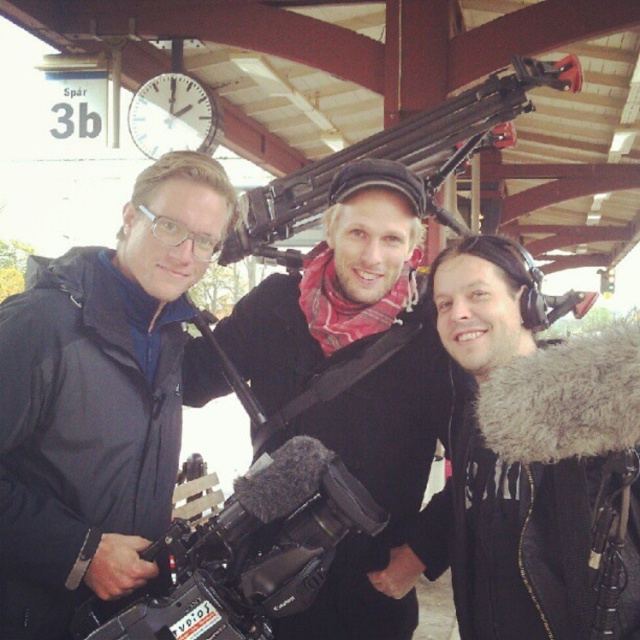
Question: Which of the following is the closest to the observer?

Choices:
 (A) click(314, 513)
 (B) click(493, 99)
 (C) click(337, 305)
 (D) click(12, 625)

Answer: (A)

Question: Can you confirm if black matte jacket at left is positioned below black matte camera at center?

Choices:
 (A) no
 (B) yes

Answer: (B)

Question: Does black matte jacket at left lie behind black matte video camera at center?

Choices:
 (A) no
 (B) yes

Answer: (B)

Question: Among these objects, which one is nearest to the camera?

Choices:
 (A) matte black machine gun at center
 (B) black matte camera at center
 (C) black matte video camera at center
 (D) black matte jacket at left

Answer: (C)

Question: Does black matte jacket at left appear over matte black machine gun at center?

Choices:
 (A) no
 (B) yes

Answer: (A)

Question: Which point is closer to the camera taking this photo?

Choices:
 (A) [353, 570]
 (B) [230, 520]
 (C) [512, 106]

Answer: (B)